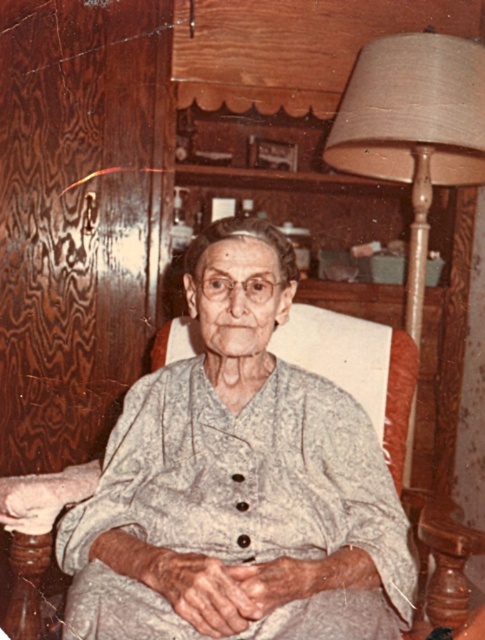
Looking at this image, is white textured dress at center taller than beige fabric lampshade at right?

Yes, white textured dress at center is taller than beige fabric lampshade at right.

From the picture: Does white textured dress at center appear over beige fabric lampshade at right?

No.

Between point (139, 538) and point (359, 157), which one is positioned behind?

The point (359, 157) is behind.

You are a GUI agent. You are given a task and a screenshot of the screen. Output one action in this format:
    pyautogui.click(x=<x>, y=<y>)
    Task: Click on the white textured dress at center
    Image resolution: width=485 pixels, height=640 pixels.
    Given the screenshot: What is the action you would take?
    pyautogui.click(x=239, y=483)